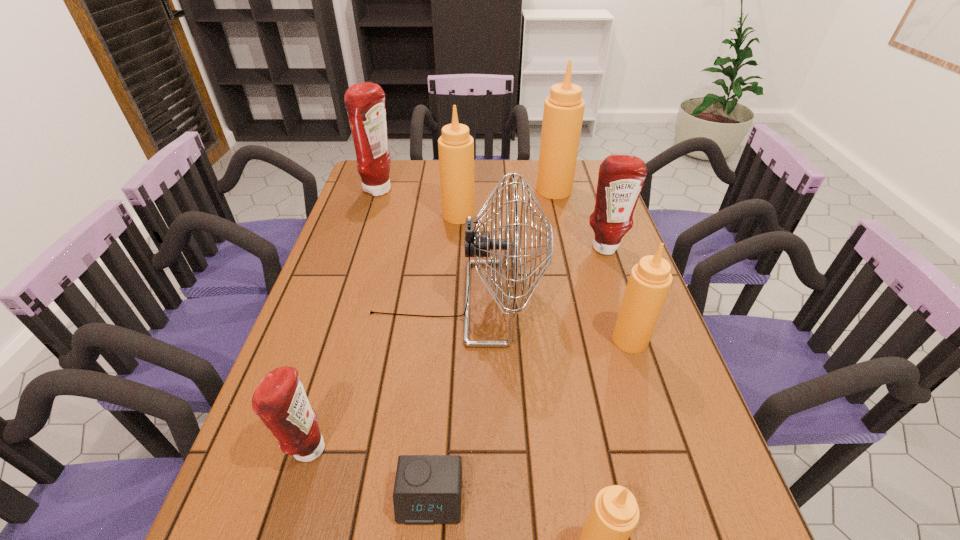
Image resolution: width=960 pixels, height=540 pixels. I want to click on free space that satisfies the following two spatial constraints: 1. on the back side of the fifth farthest condiment; 2. on the front-facing side of the fan, so click(x=617, y=302).

Locate an element on the screen. The image size is (960, 540). free space in the image that satisfies the following two spatial constraints: 1. on the front-facing side of the fan; 2. on the front-facing side of the alarm clock is located at coordinates (446, 498).